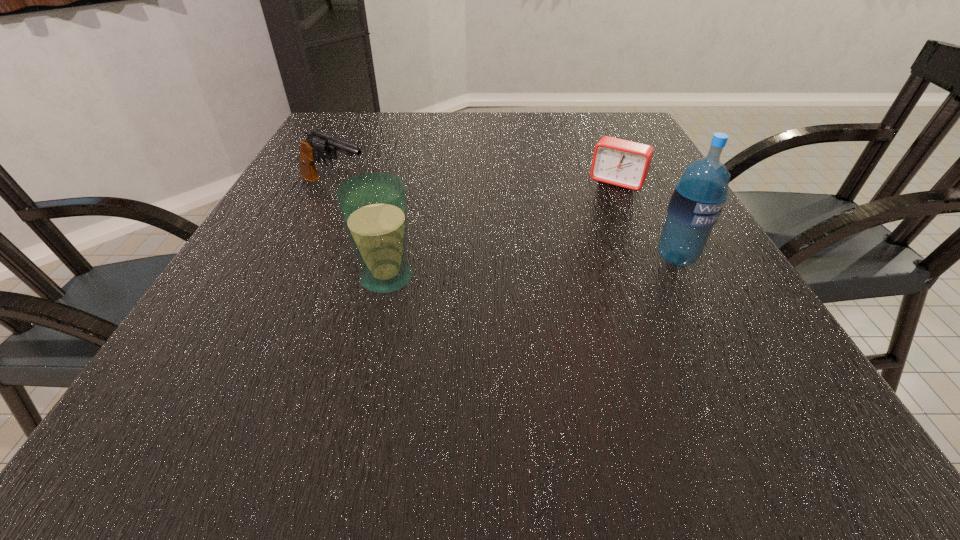
At what (x,y) coordinates should I click in order to perform the action: click on vacant area that lies between the water bottle and the third tallest object. Please return your answer as a coordinate pair (x, y). This screenshot has width=960, height=540. Looking at the image, I should click on (505, 222).

Choose which object is the second nearest neighbor to the third tallest object. Please provide its 2D coordinates. Your answer should be formatted as a tuple, i.e. [(x, y)], where the tuple contains the x and y coordinates of a point satisfying the conditions above.

[(618, 162)]

Point out which object is positioned as the third nearest to the glass. Please provide its 2D coordinates. Your answer should be formatted as a tuple, i.e. [(x, y)], where the tuple contains the x and y coordinates of a point satisfying the conditions above.

[(698, 197)]

I want to click on vacant area that satisfies the following two spatial constraints: 1. on the front side of the gun; 2. on the right side of the second object from left to right, so click(x=293, y=278).

Identify the location of free space in the image that satisfies the following two spatial constraints: 1. on the front side of the shortest object; 2. on the right side of the water bottle. (651, 258).

Locate an element on the screen. The image size is (960, 540). free space that satisfies the following two spatial constraints: 1. on the front side of the alarm clock; 2. on the left side of the tallest object is located at coordinates (651, 258).

This screenshot has width=960, height=540. Identify the location of vacant area in the image that satisfies the following two spatial constraints: 1. on the front side of the water bottle; 2. on the left side of the shortest object. (651, 258).